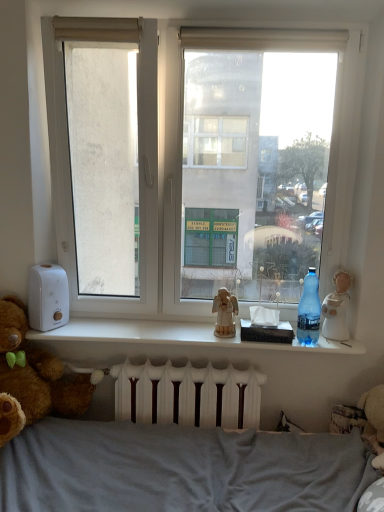
Where is `free region on the left part of wooden angel at center, arranged as the first figurine when viewed from the left`? Image resolution: width=384 pixels, height=512 pixels. free region on the left part of wooden angel at center, arranged as the first figurine when viewed from the left is located at coordinates (192, 328).